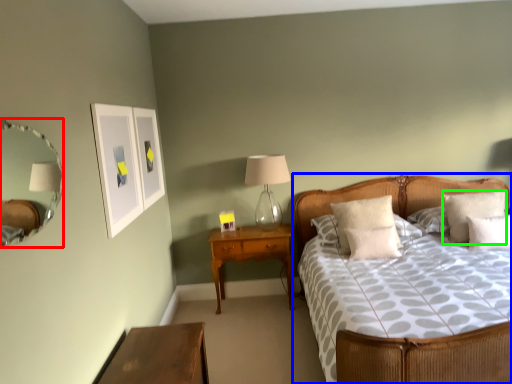
Question: Estimate the real-world distances between objects in this image. Which object is farther from mirror (highlighted by a red box), bed (highlighted by a blue box) or pillow (highlighted by a green box)?

Choices:
 (A) bed
 (B) pillow

Answer: (B)